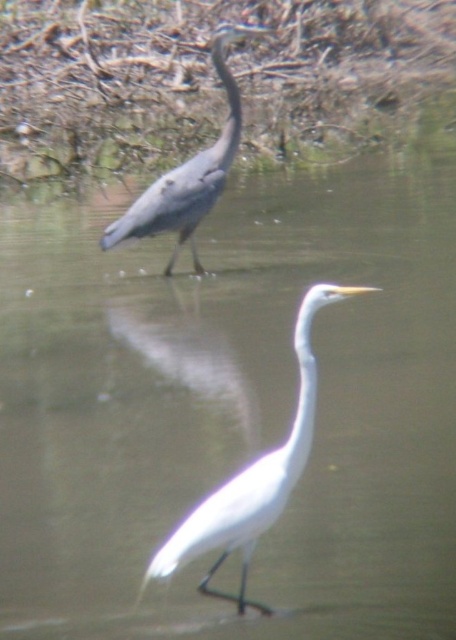
Question: Which point appears farthest from the camera in this image?

Choices:
 (A) (232, 525)
 (B) (228, 68)

Answer: (B)

Question: Which object is farther from the camera taking this photo?

Choices:
 (A) white smooth bird at center
 (B) gray matte heron at upper left

Answer: (B)

Question: Does white smooth bird at center have a smaller size compared to gray matte heron at upper left?

Choices:
 (A) no
 (B) yes

Answer: (B)

Question: Can you confirm if white smooth bird at center is positioned to the left of gray matte heron at upper left?

Choices:
 (A) yes
 (B) no

Answer: (B)

Question: Is white smooth bird at center to the right of gray matte heron at upper left from the viewer's perspective?

Choices:
 (A) no
 (B) yes

Answer: (B)